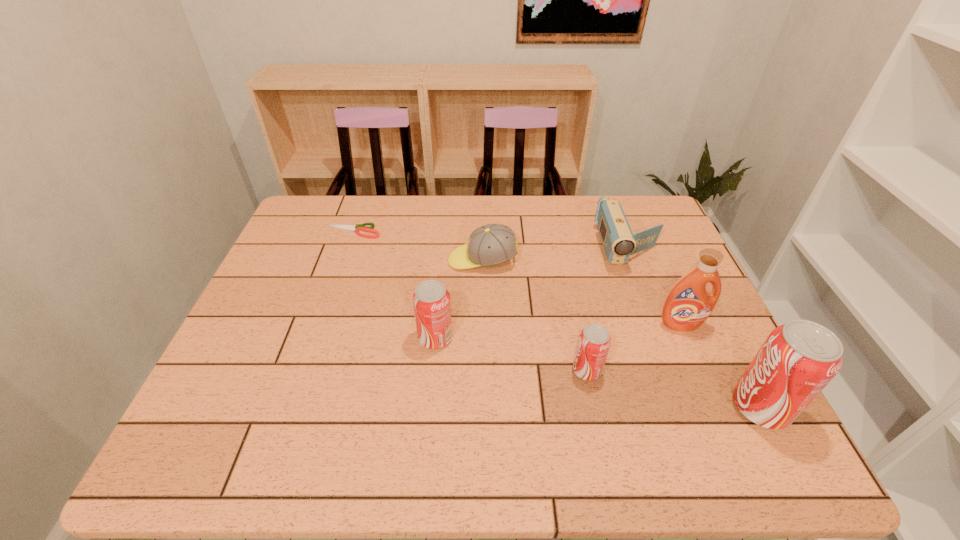
With all soda cans evenly spaced, where should an extra soda can be placed on the left to continue the pattern? Please point out a vacant space. Please provide its 2D coordinates. Your answer should be formatted as a tuple, i.e. [(x, y)], where the tuple contains the x and y coordinates of a point satisfying the conditions above.

[(302, 309)]